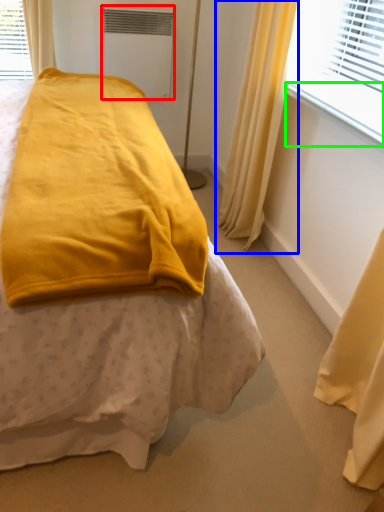
Question: Which object is positioned closest to air conditioning (highlighted by a red box)? Select from curtain (highlighted by a blue box) and window sill (highlighted by a green box).

Choices:
 (A) curtain
 (B) window sill

Answer: (A)